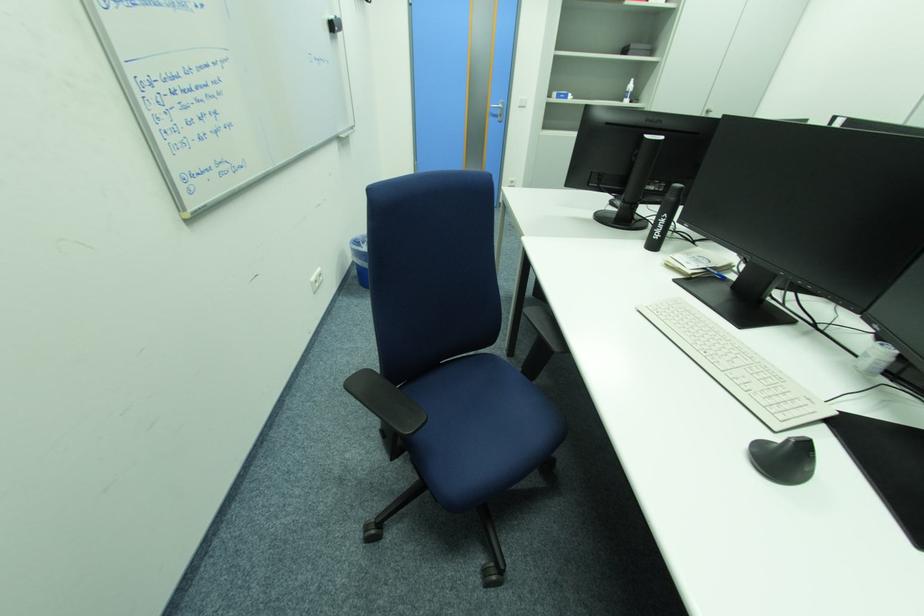
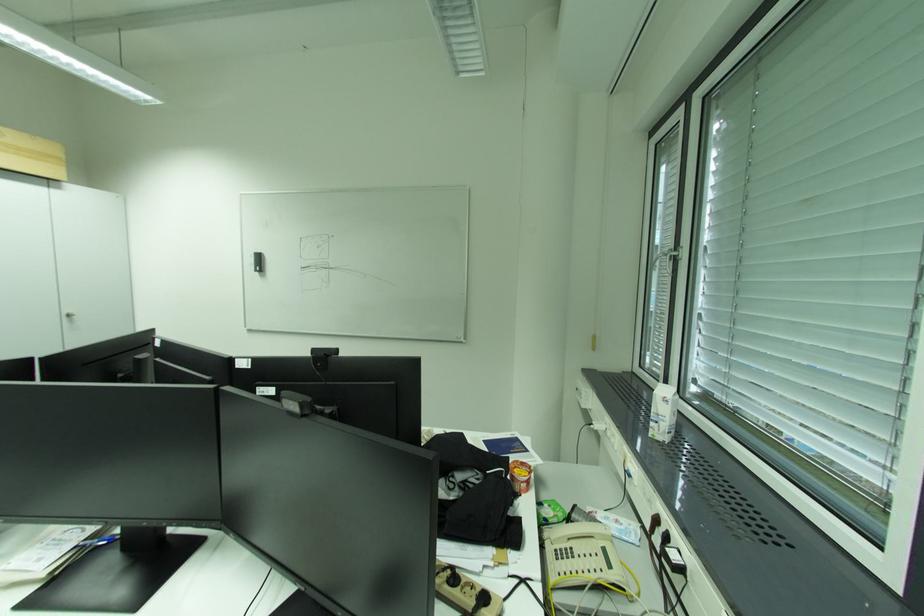
Question: Based on the continuous images, in which direction is the camera rotating? Reply with the corresponding letter.

Choices:
 (A) Left
 (B) Right
 (C) Up
 (D) Down

Answer: (B)